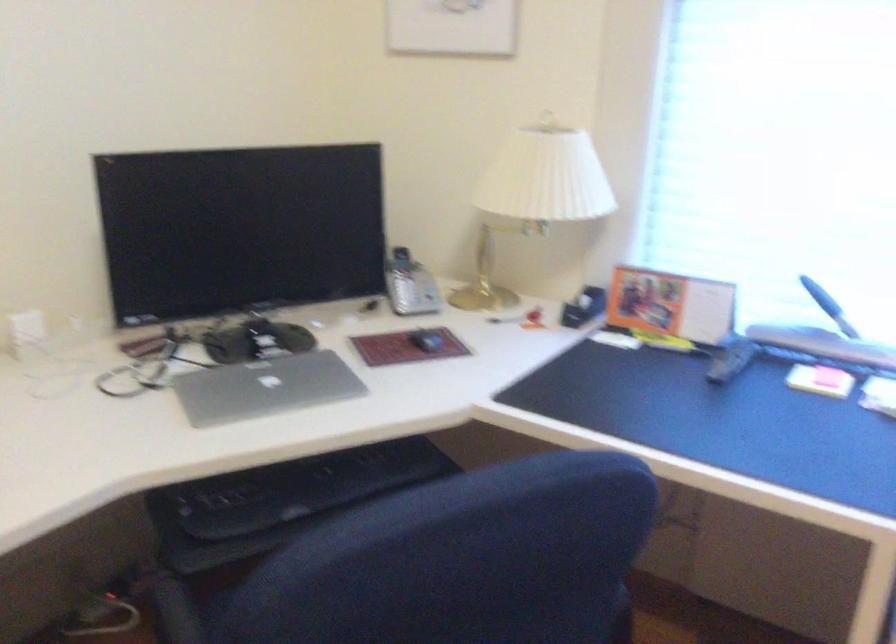
What do you see at coordinates (302, 488) in the screenshot? The height and width of the screenshot is (644, 896). I see `a black keyboard` at bounding box center [302, 488].